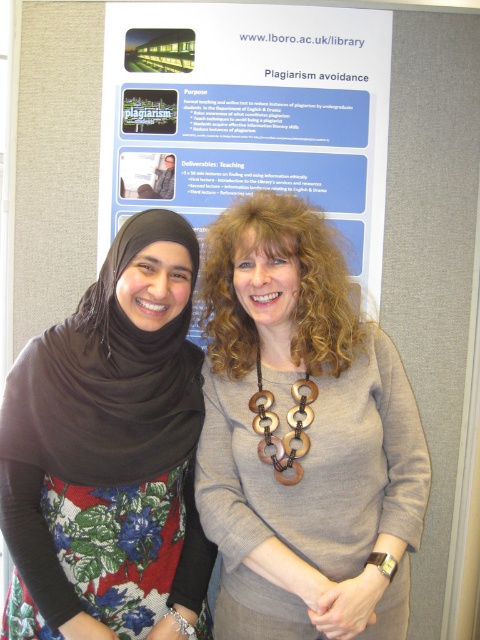
You are a photographer who wants to capture a clear photo of both the floral fabric dress at center and the wooden rings at center. Since the camera can only focus on one object at a time, which object should you focus on to ensure the smaller one is in focus?

The wooden rings at center are smaller than the floral fabric dress at center, so focusing on the wooden rings at center will ensure the smaller object is in focus.

You are standing at a distance of 1.80 meters from the point marked as point [180,83] in the image. If you want to move closer to this point, which direction should you walk? Please answer with either left, right, forward, or backward.

Since you are already at the distance of 1.80 meters from point [180,83], to move closer to it, you should walk forward.